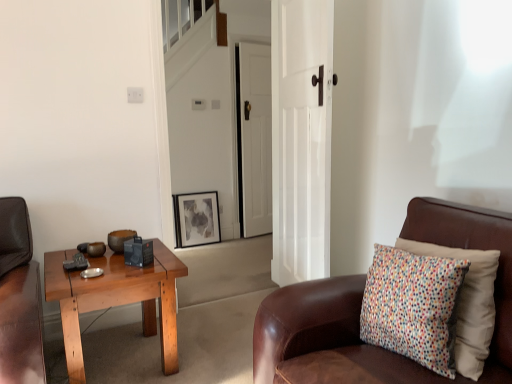
Where is `vacant space that is to the left of white glossy door at center, placed as the 2th door when sorted from back to front`? This screenshot has height=384, width=512. vacant space that is to the left of white glossy door at center, placed as the 2th door when sorted from back to front is located at coordinates (221, 325).